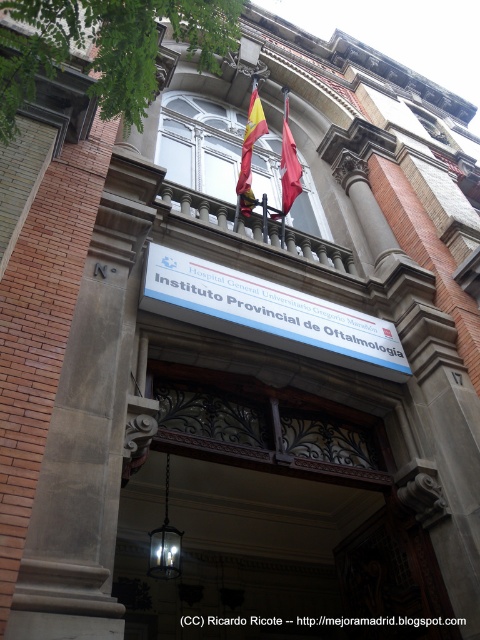
Measure the distance between dark brown wooden door at center and white plastic sign at center.

The distance of dark brown wooden door at center from white plastic sign at center is 8.50 meters.

From the picture: Who is shorter, dark brown wooden door at center or white plastic sign at center?

white plastic sign at center

Is point (328, 525) less distant than point (292, 333)?

No, (328, 525) is further to viewer.

This screenshot has height=640, width=480. Identify the location of dark brown wooden door at center. (269, 520).

Does dark brown wooden door at center come in front of polished wood balcony at upper center?

That is True.

Does point (184, 637) lie behind point (274, 234)?

No, (184, 637) is in front of (274, 234).

Locate an element on the screen. dark brown wooden door at center is located at coordinates (269, 520).

Is red fabric flag at upper center below red fabric flag at center?

Yes, red fabric flag at upper center is below red fabric flag at center.

Is point (254, 115) closer to camera compared to point (291, 189)?

No.

The height and width of the screenshot is (640, 480). What do you see at coordinates (250, 152) in the screenshot?
I see `red fabric flag at upper center` at bounding box center [250, 152].

Identify the location of red fabric flag at upper center. (250, 152).